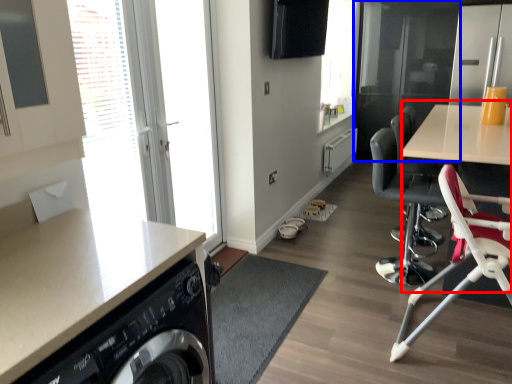
Question: Which object appears closest to the camera in this image, computer desk (highlighted by a red box) or screen door (highlighted by a blue box)?

Choices:
 (A) computer desk
 (B) screen door

Answer: (A)